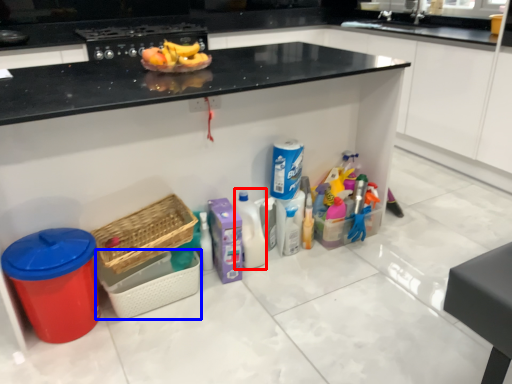
Question: Which of the following is the closest to the observer, cleaning product (highlighted by a red box) or basket (highlighted by a blue box)?

Choices:
 (A) cleaning product
 (B) basket

Answer: (B)